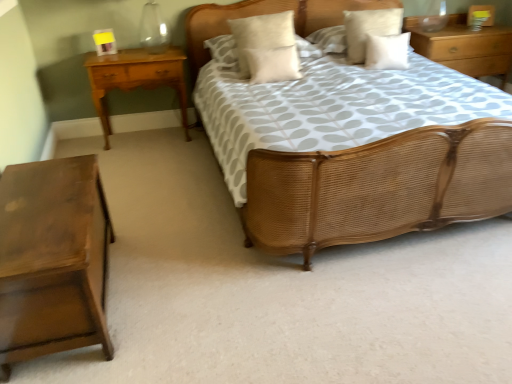
Locate an element on the screen. free space behind dark brown wood nightstand at lower left, acting as the 3th nightstand starting from the top is located at coordinates (156, 219).